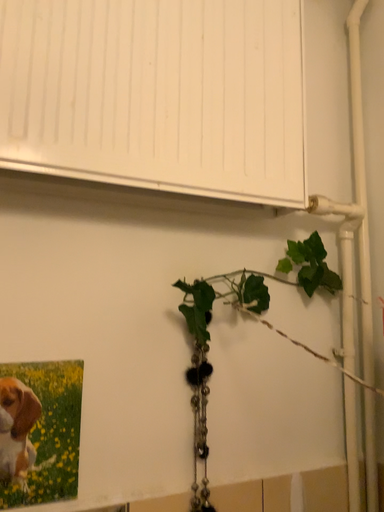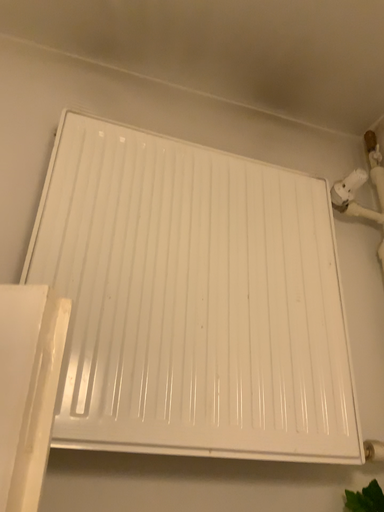
Question: Which way did the camera rotate in the video?

Choices:
 (A) rotated downward
 (B) rotated upward

Answer: (B)